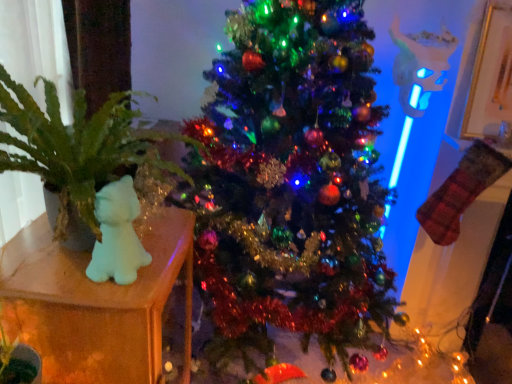
Question: Does point (111, 382) appear closer or farther from the camera than point (106, 175)?

Choices:
 (A) farther
 (B) closer

Answer: (B)

Question: In terms of height, does translucent plastic bear at left look taller or shorter compared to green leafy plant at left?

Choices:
 (A) short
 (B) tall

Answer: (B)

Question: Estimate the real-world distances between objects in this image. Which object is closer to the green leafy plant at left?

Choices:
 (A) translucent plastic bear at left
 (B) shiny green christmas tree at center

Answer: (A)

Question: Which is farther from the shiny green christmas tree at center?

Choices:
 (A) translucent plastic bear at left
 (B) green leafy plant at left

Answer: (A)